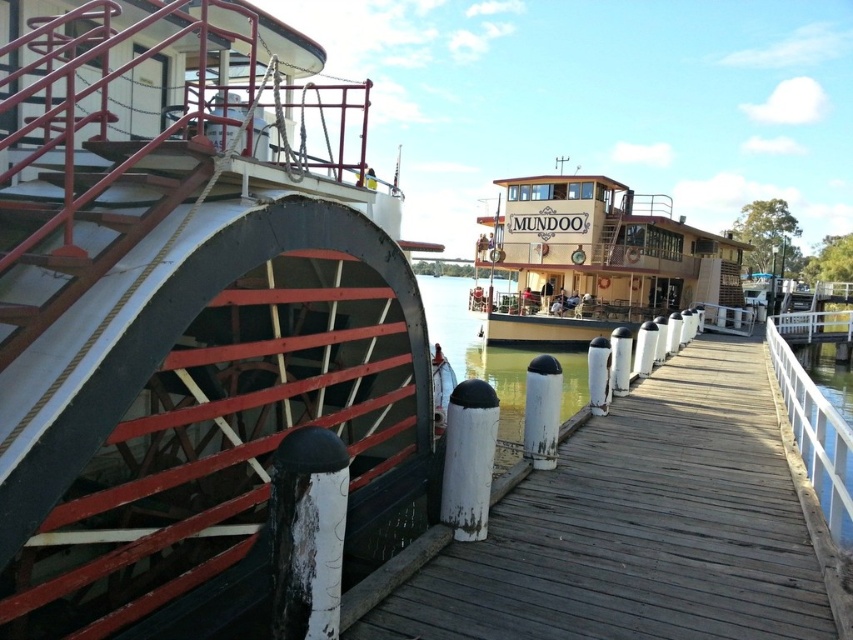
Question: Which of the following is the farthest from the observer?

Choices:
 (A) (511, 324)
 (B) (364, 298)

Answer: (A)

Question: From the image, what is the correct spatial relationship of wooden dock at center in relation to wooden polished boat at center?

Choices:
 (A) above
 (B) below

Answer: (B)

Question: Which of the following is the closest to the observer?

Choices:
 (A) wooden paddlewheel at left
 (B) wooden polished boat at center
 (C) wooden dock at center

Answer: (C)

Question: Is wooden paddlewheel at left thinner than wooden dock at center?

Choices:
 (A) no
 (B) yes

Answer: (B)

Question: Where is wooden dock at center located in relation to wooden polished boat at center in the image?

Choices:
 (A) left
 (B) right

Answer: (A)

Question: Which object is farther from the camera taking this photo?

Choices:
 (A) wooden polished boat at center
 (B) wooden paddlewheel at left
 (C) wooden dock at center

Answer: (A)